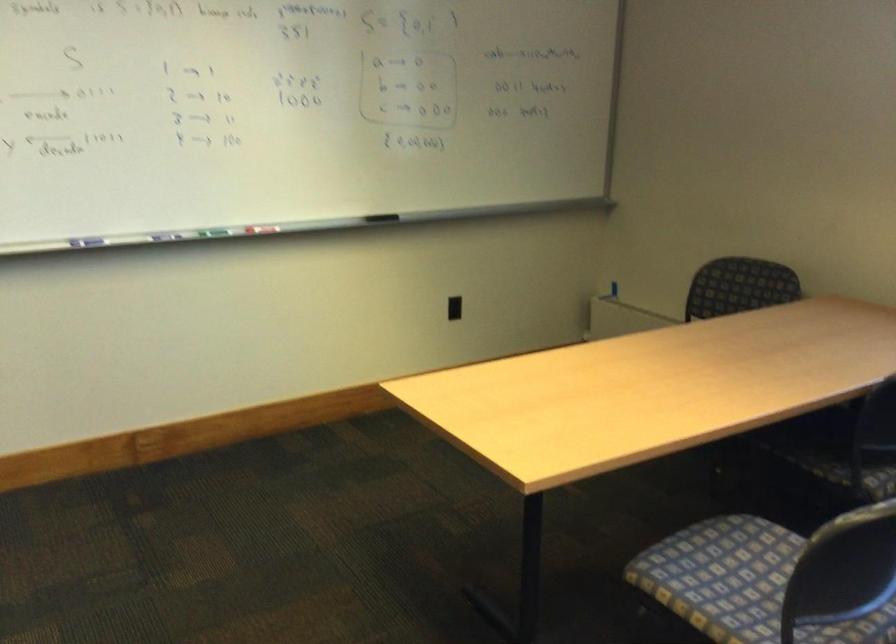
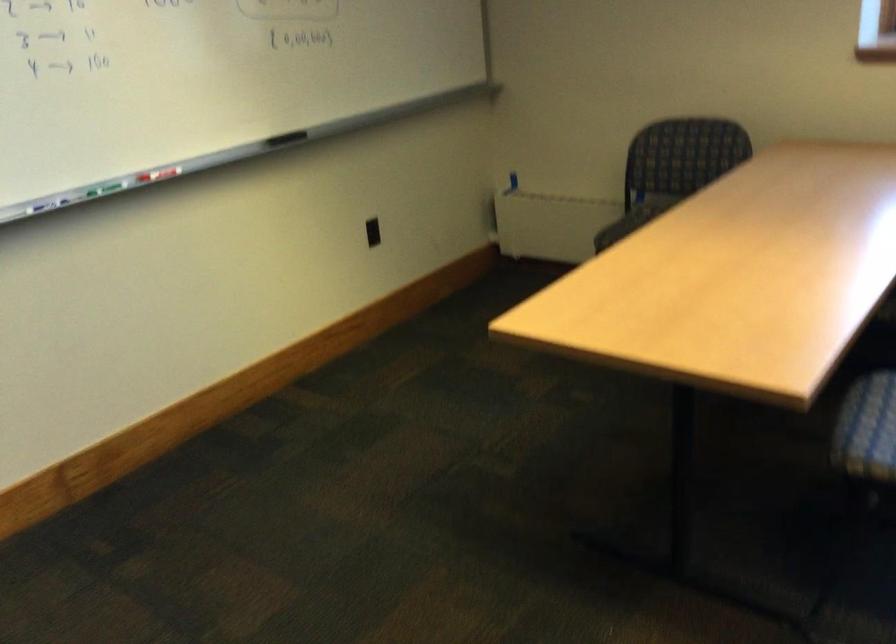
Where in the second image is the point corresponding to the point at 179,225 from the first image?

(65, 194)